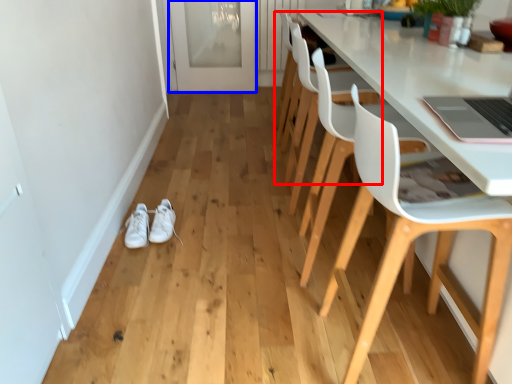
Question: Among these objects, which one is nearest to the camera, chair (highlighted by a red box) or glass door (highlighted by a blue box)?

Choices:
 (A) chair
 (B) glass door

Answer: (A)